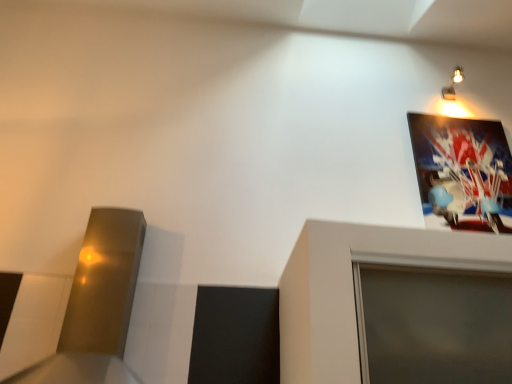
Question: Should I look upward or downward to see metallic wall sconce at upper right?

Choices:
 (A) down
 (B) up

Answer: (B)

Question: Considering the relative sizes of metallic glossy picture frame at upper right and metallic wall sconce at upper right in the image provided, is metallic glossy picture frame at upper right smaller than metallic wall sconce at upper right?

Choices:
 (A) yes
 (B) no

Answer: (B)

Question: Does metallic glossy picture frame at upper right have a greater height compared to metallic wall sconce at upper right?

Choices:
 (A) yes
 (B) no

Answer: (A)

Question: Considering the relative positions of metallic glossy picture frame at upper right and metallic wall sconce at upper right in the image provided, is metallic glossy picture frame at upper right to the right of metallic wall sconce at upper right from the viewer's perspective?

Choices:
 (A) no
 (B) yes

Answer: (A)

Question: Is metallic glossy picture frame at upper right thinner than metallic wall sconce at upper right?

Choices:
 (A) yes
 (B) no

Answer: (A)

Question: Is metallic glossy picture frame at upper right positioned before metallic wall sconce at upper right?

Choices:
 (A) no
 (B) yes

Answer: (B)

Question: Is metallic glossy picture frame at upper right touching metallic wall sconce at upper right?

Choices:
 (A) yes
 (B) no

Answer: (B)

Question: From a real-world perspective, is metallic wall sconce at upper right on metallic glossy picture frame at upper right?

Choices:
 (A) no
 (B) yes

Answer: (B)

Question: From the image's perspective, is metallic wall sconce at upper right located beneath metallic glossy picture frame at upper right?

Choices:
 (A) yes
 (B) no

Answer: (B)

Question: Is metallic wall sconce at upper right with metallic glossy picture frame at upper right?

Choices:
 (A) no
 (B) yes

Answer: (A)

Question: Is metallic wall sconce at upper right smaller than metallic glossy picture frame at upper right?

Choices:
 (A) no
 (B) yes

Answer: (B)

Question: Is metallic wall sconce at upper right not within metallic glossy picture frame at upper right?

Choices:
 (A) yes
 (B) no

Answer: (A)

Question: Can you confirm if metallic wall sconce at upper right is positioned to the right of metallic glossy picture frame at upper right?

Choices:
 (A) yes
 (B) no

Answer: (A)

Question: Is metallic wall sconce at upper right spatially inside metallic glossy picture frame at upper right, or outside of it?

Choices:
 (A) outside
 (B) inside

Answer: (A)